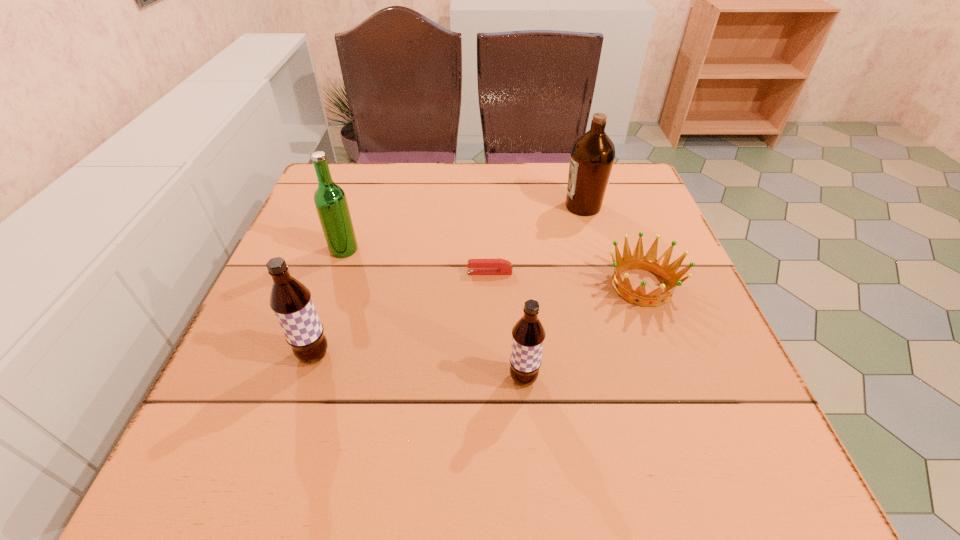
The image size is (960, 540). I want to click on beer bottle present at the left edge, so click(330, 200).

Where is `olive oil situated at the right edge`? This screenshot has width=960, height=540. olive oil situated at the right edge is located at coordinates (592, 156).

At what (x,y) coordinates should I click in order to perform the action: click on crown that is at the right edge. Please return your answer as a coordinate pair (x, y). This screenshot has height=540, width=960. Looking at the image, I should click on (649, 262).

Where is `object at the far right corner`? The image size is (960, 540). object at the far right corner is located at coordinates (592, 156).

In the image, there is a desktop. Where is `vacant space at the far edge`? The height and width of the screenshot is (540, 960). vacant space at the far edge is located at coordinates (443, 195).

The image size is (960, 540). Identify the location of vacant space at the near edge of the desktop. (376, 409).

Locate an element on the screen. free space at the left edge is located at coordinates (230, 368).

The height and width of the screenshot is (540, 960). In the image, there is a desktop. Find the location of `free space at the right edge`. free space at the right edge is located at coordinates (636, 212).

At what (x,y) coordinates should I click in order to perform the action: click on free space at the far left corner of the desktop. Please return your answer as a coordinate pair (x, y). The width and height of the screenshot is (960, 540). Looking at the image, I should click on (314, 208).

In the image, there is a desktop. Identify the location of free space at the near right corner. (666, 386).